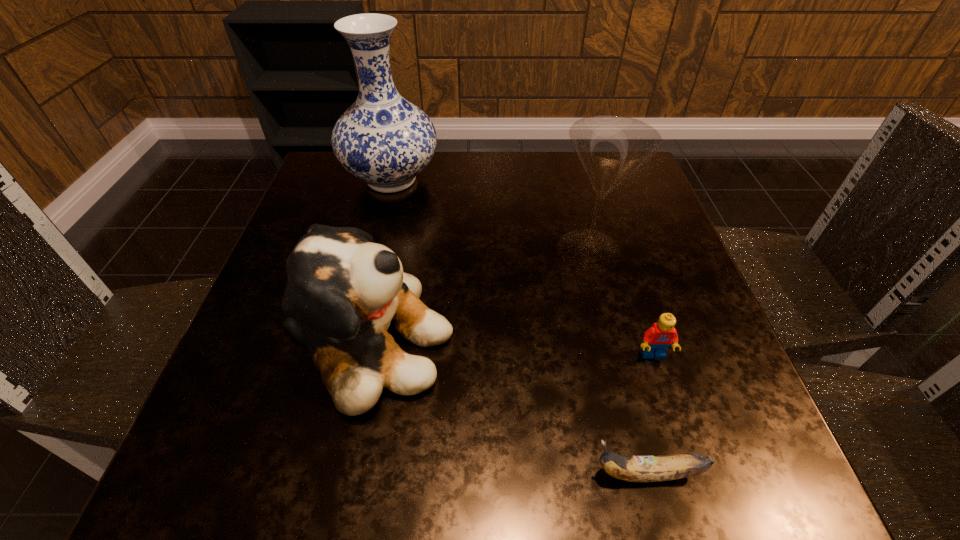
Where is `vacant space located on the face of the Lego`? The height and width of the screenshot is (540, 960). vacant space located on the face of the Lego is located at coordinates (696, 490).

Find the location of a particular element. This screenshot has height=540, width=960. vacant space situated 0.210m on the peel of the shortest object is located at coordinates (431, 474).

Where is `vacant area situated 0.230m on the peel of the shortest object`? The width and height of the screenshot is (960, 540). vacant area situated 0.230m on the peel of the shortest object is located at coordinates (417, 474).

Locate an element on the screen. The height and width of the screenshot is (540, 960). free space located 0.110m on the peel of the shortest object is located at coordinates (507, 474).

Where is `object that is at the far edge`? object that is at the far edge is located at coordinates (383, 139).

Image resolution: width=960 pixels, height=540 pixels. What are the coordinates of `object positioned at the near edge` in the screenshot? It's located at (668, 467).

Where is `vase situated at the left edge`? Image resolution: width=960 pixels, height=540 pixels. vase situated at the left edge is located at coordinates (383, 139).

Identify the location of puppy located at the left edge. The height and width of the screenshot is (540, 960). (347, 291).

This screenshot has height=540, width=960. What are the coordinates of `flute glass that is at the right edge` in the screenshot? It's located at coord(611,147).

You are a GUI agent. You are given a task and a screenshot of the screen. Output one action in this format:
    pyautogui.click(x=<x>, y=<y>)
    Task: Click on the Lego that is at the right edge
    
    Given the screenshot: What is the action you would take?
    pyautogui.click(x=657, y=339)